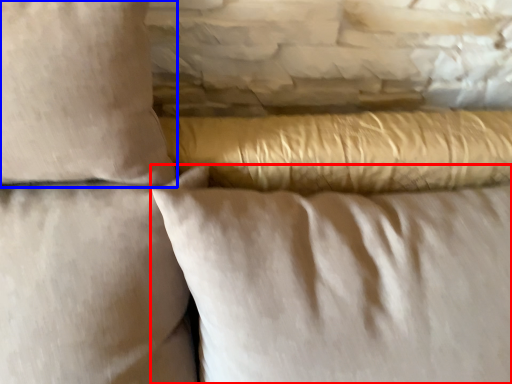
Question: Which object is further to the camera taking this photo, pillow (highlighted by a red box) or pillow (highlighted by a blue box)?

Choices:
 (A) pillow
 (B) pillow

Answer: (A)